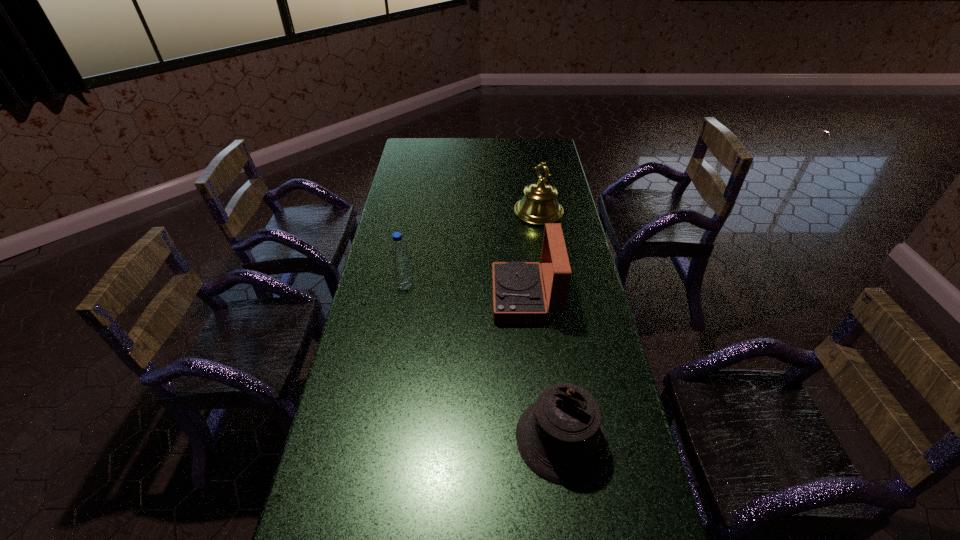
What are the coordinates of `the farthest object` in the screenshot? It's located at (539, 205).

Where is `phonograph record`? This screenshot has height=540, width=960. phonograph record is located at coordinates (518, 295).

What are the coordinates of `the leftmost object` in the screenshot? It's located at (399, 252).

The image size is (960, 540). In order to click on the nearest object in this screenshot , I will do `click(560, 437)`.

Where is `vacant space located 0.070m on the left of the farther bell`? Image resolution: width=960 pixels, height=540 pixels. vacant space located 0.070m on the left of the farther bell is located at coordinates (498, 213).

Image resolution: width=960 pixels, height=540 pixels. I want to click on vacant area situated 0.350m on the face of the phonograph record, so click(392, 299).

Where is `vacant space located 0.330m on the face of the phonograph record`? vacant space located 0.330m on the face of the phonograph record is located at coordinates (397, 299).

The width and height of the screenshot is (960, 540). In order to click on vacant space located on the face of the phonograph record in this screenshot , I will do `click(420, 299)`.

Identify the location of vacant area situated on the left of the water bottle. (369, 286).

Image resolution: width=960 pixels, height=540 pixels. What are the coordinates of `free space located 0.350m on the left of the nearest object` in the screenshot? It's located at (382, 438).